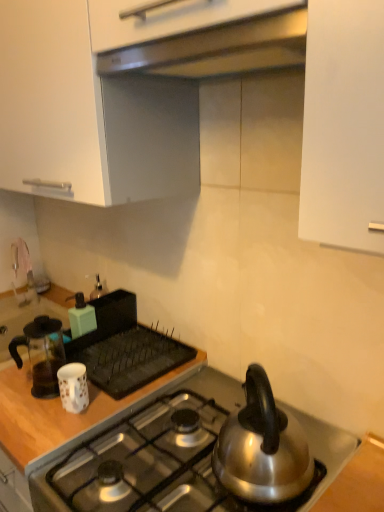
How much space does transparent glass coffee pot at left, arranged as the second kitchen appliance when viewed from the back, occupy vertically?

transparent glass coffee pot at left, arranged as the second kitchen appliance when viewed from the back, is 7.93 inches in height.

Describe the element at coordinates (73, 387) in the screenshot. I see `white glossy mug at lower left, arranged as the third kitchen appliance when viewed from the back` at that location.

In order to face woodenmaterial/texturecountertop at left, should I rotate leftwards or rightwards?

Rotate left and turn 18.247 degrees.

This screenshot has width=384, height=512. Describe the element at coordinates (66, 414) in the screenshot. I see `woodenmaterial/texturecountertop at left` at that location.

In order to click on polished stainless steel gas stove at lower center in this screenshot , I will do `click(170, 463)`.

Does polished stainless steel gas stove at lower center touch matte green soap dispenser at upper left, arranged as the 3th kitchen appliance when viewed from the front?

No, polished stainless steel gas stove at lower center is not in contact with matte green soap dispenser at upper left, arranged as the 3th kitchen appliance when viewed from the front.

In the image, is polished stainless steel gas stove at lower center on the left side or the right side of matte green soap dispenser at upper left, arranged as the 3th kitchen appliance when viewed from the front?

From the image, it's evident that polished stainless steel gas stove at lower center is to the right of matte green soap dispenser at upper left, arranged as the 3th kitchen appliance when viewed from the front.

Who is shorter, polished stainless steel gas stove at lower center or matte green soap dispenser at upper left, arranged as the 3th kitchen appliance when viewed from the front?

With less height is matte green soap dispenser at upper left, arranged as the 3th kitchen appliance when viewed from the front.

How much distance is there between satin silver exhaust hood at upper center and matte green soap dispenser at upper left, arranged as the 3th kitchen appliance when viewed from the front?

satin silver exhaust hood at upper center is 37.17 inches away from matte green soap dispenser at upper left, arranged as the 3th kitchen appliance when viewed from the front.

Choose the correct answer: Is satin silver exhaust hood at upper center inside matte green soap dispenser at upper left, which ranks as the 1th kitchen appliance in back-to-front order, or outside it?

satin silver exhaust hood at upper center is located beyond the bounds of matte green soap dispenser at upper left, which ranks as the 1th kitchen appliance in back-to-front order.

How many degrees apart are the facing directions of satin silver exhaust hood at upper center and matte green soap dispenser at upper left, arranged as the 3th kitchen appliance when viewed from the front?

The angular difference between satin silver exhaust hood at upper center and matte green soap dispenser at upper left, arranged as the 3th kitchen appliance when viewed from the front, is 2.7 degrees.

Considering the positions of point (272, 62) and point (77, 298), is point (272, 62) closer or farther from the camera than point (77, 298)?

Point (272, 62) is closer to the camera than point (77, 298).

Where is `kitchen appliance that is the 3rd one when counting rightward from the woodenmaterial/texturecountertop at left`? The image size is (384, 512). kitchen appliance that is the 3rd one when counting rightward from the woodenmaterial/texturecountertop at left is located at coordinates (73, 387).

Is woodenmaterial/texturecountertop at left outside of white glossy mug at lower left, which ranks as the 1th kitchen appliance in front-to-back order?

Yes, woodenmaterial/texturecountertop at left is located beyond the bounds of white glossy mug at lower left, which ranks as the 1th kitchen appliance in front-to-back order.

Considering the points (96, 394) and (58, 380), which point is behind, point (96, 394) or point (58, 380)?

Point (96, 394)

Is woodenmaterial/texturecountertop at left with white glossy mug at lower left, which ranks as the 1th kitchen appliance in front-to-back order?

No, woodenmaterial/texturecountertop at left is not with white glossy mug at lower left, which ranks as the 1th kitchen appliance in front-to-back order.

Is transparent glass coffee pot at left, the 2th kitchen appliance in the front-to-back sequence, oriented away from polished stainless steel gas stove at lower center?

No.

From a real-world perspective, is transparent glass coffee pot at left, the 2th kitchen appliance in the front-to-back sequence, above or below polished stainless steel gas stove at lower center?

transparent glass coffee pot at left, the 2th kitchen appliance in the front-to-back sequence, is situated higher than polished stainless steel gas stove at lower center in the real world.

Is polished stainless steel gas stove at lower center inside transparent glass coffee pot at left, the 2th kitchen appliance in the front-to-back sequence?

Definitely not — polished stainless steel gas stove at lower center is not inside transparent glass coffee pot at left, the 2th kitchen appliance in the front-to-back sequence.

Does transparent glass coffee pot at left, the 2th kitchen appliance in the front-to-back sequence, appear on the left side of polished stainless steel gas stove at lower center?

Yes.

From a real-world perspective, starting from the silver metallic kettle at right, which kitchen appliance is the 2nd one below it? Please provide its 2D coordinates.

[(73, 387)]

Can you confirm if silver metallic kettle at right is taller than white glossy mug at lower left, which ranks as the 1th kitchen appliance in front-to-back order?

Yes, silver metallic kettle at right is taller than white glossy mug at lower left, which ranks as the 1th kitchen appliance in front-to-back order.

From a real-world perspective, is silver metallic kettle at right over white glossy mug at lower left, which ranks as the 1th kitchen appliance in front-to-back order?

Yes, from a real-world perspective, silver metallic kettle at right is over white glossy mug at lower left, which ranks as the 1th kitchen appliance in front-to-back order

Can you confirm if silver metallic kettle at right is positioned to the right of white glossy mug at lower left, arranged as the third kitchen appliance when viewed from the back?

Yes.

Which is correct: satin silver exhaust hood at upper center is inside woodenmaterial/texturecountertop at left, or outside of it?

satin silver exhaust hood at upper center is located beyond the bounds of woodenmaterial/texturecountertop at left.

In the image, there is a woodenmaterial/texturecountertop at left. In order to click on exhaust hood above it (from the image's perspective) in this screenshot , I will do `click(217, 48)`.

From the image's perspective, is satin silver exhaust hood at upper center over woodenmaterial/texturecountertop at left?

Indeed, from the image's perspective, satin silver exhaust hood at upper center is shown above woodenmaterial/texturecountertop at left.

Is point (208, 49) positioned behind point (6, 419)?

That is False.

From the image's perspective, is woodenmaterial/texturecountertop at left under matte green soap dispenser at upper left, arranged as the 3th kitchen appliance when viewed from the front?

Indeed, from the image's perspective, woodenmaterial/texturecountertop at left is shown beneath matte green soap dispenser at upper left, arranged as the 3th kitchen appliance when viewed from the front.

Does woodenmaterial/texturecountertop at left have a lesser width compared to matte green soap dispenser at upper left, which ranks as the 1th kitchen appliance in back-to-front order?

No, woodenmaterial/texturecountertop at left is not thinner than matte green soap dispenser at upper left, which ranks as the 1th kitchen appliance in back-to-front order.

From a real-world perspective, which is physically below, woodenmaterial/texturecountertop at left or matte green soap dispenser at upper left, arranged as the 3th kitchen appliance when viewed from the front?

woodenmaterial/texturecountertop at left is physically lower.

Based on the photo, is woodenmaterial/texturecountertop at left positioned far away from matte green soap dispenser at upper left, arranged as the 3th kitchen appliance when viewed from the front?

woodenmaterial/texturecountertop at left is actually quite close to matte green soap dispenser at upper left, arranged as the 3th kitchen appliance when viewed from the front.

The height and width of the screenshot is (512, 384). Identify the location of gas stove that is under the matte green soap dispenser at upper left, which ranks as the 1th kitchen appliance in back-to-front order (from a real-world perspective). (170, 463).

I want to click on exhaust hood above the matte green soap dispenser at upper left, arranged as the 3th kitchen appliance when viewed from the front (from the image's perspective), so click(217, 48).

From the image, which object appears to be farther from transparent glass coffee pot at left, arranged as the second kitchen appliance when viewed from the back, woodenmaterial/texturecountertop at left or polished stainless steel gas stove at lower center?

The object further to transparent glass coffee pot at left, arranged as the second kitchen appliance when viewed from the back, is polished stainless steel gas stove at lower center.

Which object lies nearer to the anchor point white glossy mug at lower left, which ranks as the 1th kitchen appliance in front-to-back order, woodenmaterial/texturecountertop at left or transparent glass coffee pot at left, the 2th kitchen appliance in the front-to-back sequence?

The object closer to white glossy mug at lower left, which ranks as the 1th kitchen appliance in front-to-back order, is transparent glass coffee pot at left, the 2th kitchen appliance in the front-to-back sequence.

From the image, which object appears to be farther from transparent glass coffee pot at left, the 2th kitchen appliance in the front-to-back sequence, polished stainless steel gas stove at lower center or white glossy mug at lower left, arranged as the third kitchen appliance when viewed from the back?

polished stainless steel gas stove at lower center is positioned further to the anchor transparent glass coffee pot at left, the 2th kitchen appliance in the front-to-back sequence.

Based on their spatial positions, is satin silver exhaust hood at upper center or matte green soap dispenser at upper left, arranged as the 3th kitchen appliance when viewed from the front, further from polished stainless steel gas stove at lower center?

The object further to polished stainless steel gas stove at lower center is satin silver exhaust hood at upper center.

When comparing their distances from white glossy mug at lower left, arranged as the third kitchen appliance when viewed from the back, does satin silver exhaust hood at upper center or polished stainless steel gas stove at lower center seem further?

Based on the image, satin silver exhaust hood at upper center appears to be further to white glossy mug at lower left, arranged as the third kitchen appliance when viewed from the back.

Based on their spatial positions, is silver metallic kettle at right or matte green soap dispenser at upper left, arranged as the 3th kitchen appliance when viewed from the front, further from satin silver exhaust hood at upper center?

matte green soap dispenser at upper left, arranged as the 3th kitchen appliance when viewed from the front, lies further to satin silver exhaust hood at upper center than the other object.

When comparing their distances from transparent glass coffee pot at left, arranged as the second kitchen appliance when viewed from the back, does matte green soap dispenser at upper left, which ranks as the 1th kitchen appliance in back-to-front order, or satin silver exhaust hood at upper center seem further?

satin silver exhaust hood at upper center lies further to transparent glass coffee pot at left, arranged as the second kitchen appliance when viewed from the back, than the other object.

From the image, which object appears to be nearer to silver metallic kettle at right, woodenmaterial/texturecountertop at left or white glossy mug at lower left, arranged as the third kitchen appliance when viewed from the back?

woodenmaterial/texturecountertop at left is positioned closer to the anchor silver metallic kettle at right.

Where is `kettle located between satin silver exhaust hood at upper center and matte green soap dispenser at upper left, arranged as the 3th kitchen appliance when viewed from the front, in the depth direction`? This screenshot has height=512, width=384. kettle located between satin silver exhaust hood at upper center and matte green soap dispenser at upper left, arranged as the 3th kitchen appliance when viewed from the front, in the depth direction is located at coordinates (262, 448).

Find the location of a particular element. This screenshot has height=512, width=384. gas stove between satin silver exhaust hood at upper center and matte green soap dispenser at upper left, which ranks as the 1th kitchen appliance in back-to-front order, from front to back is located at coordinates point(170,463).

Find the location of a particular element. kitchen appliance between polished stainless steel gas stove at lower center and transparent glass coffee pot at left, arranged as the second kitchen appliance when viewed from the back, from front to back is located at coordinates (73, 387).

Locate an element on the screen. The image size is (384, 512). gas stove between satin silver exhaust hood at upper center and woodenmaterial/texturecountertop at left in the vertical direction is located at coordinates (170, 463).